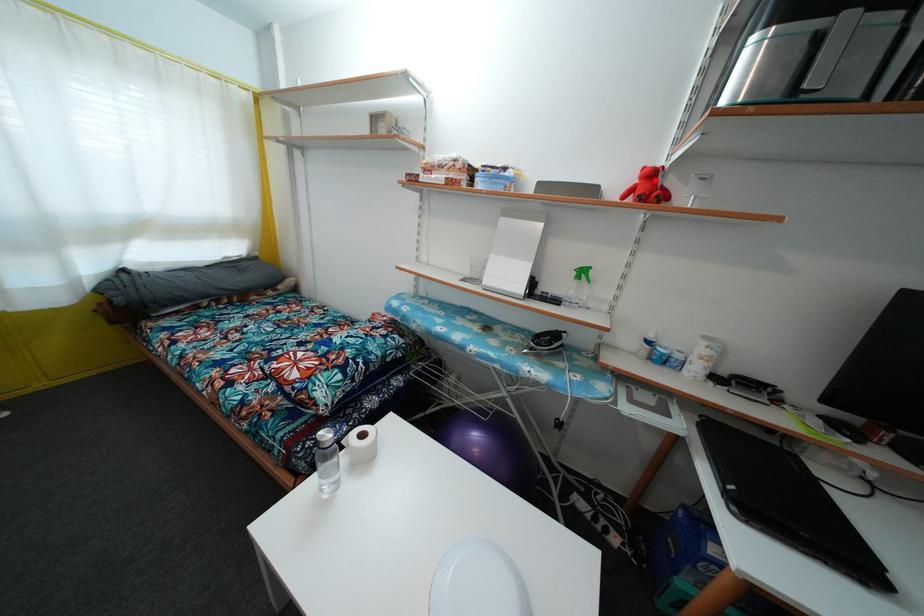
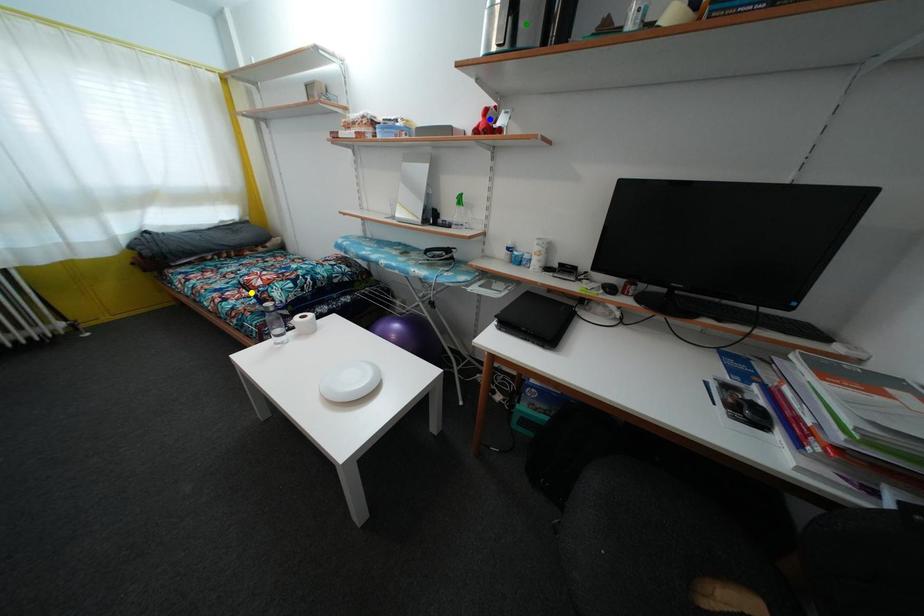
Question: I am providing you with two images of the same scene from different viewpoints. A red point is marked on the first image. You are given multiple points on the second image. Which mark in image 2 goes with the point in image 1?

Choices:
 (A) green point
 (B) blue point
 (C) yellow point

Answer: (B)